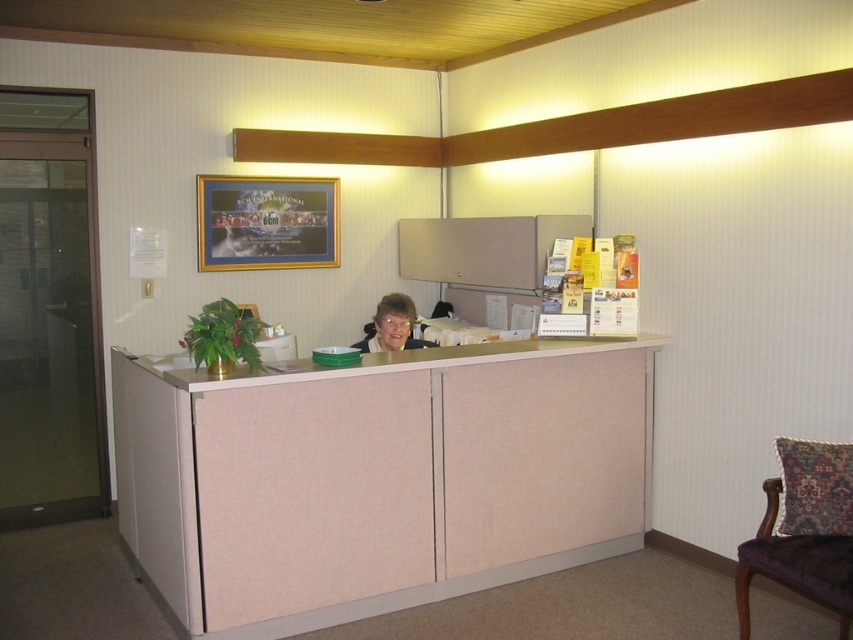
Does velvet purple chair at lower right appear over matte black hair at center?

Actually, velvet purple chair at lower right is below matte black hair at center.

Is velvet purple chair at lower right taller than matte black hair at center?

Indeed, velvet purple chair at lower right has a greater height compared to matte black hair at center.

What do you see at coordinates (804, 529) in the screenshot? I see `velvet purple chair at lower right` at bounding box center [804, 529].

Where is `velvet purple chair at lower right`? Image resolution: width=853 pixels, height=640 pixels. velvet purple chair at lower right is located at coordinates click(x=804, y=529).

Which is in front, point (479, 483) or point (780, 483)?

Point (780, 483) is more forward.

Is beige fabric desk at center positioned before velvet purple chair at lower right?

No, beige fabric desk at center is further to the viewer.

You are a GUI agent. You are given a task and a screenshot of the screen. Output one action in this format:
    pyautogui.click(x=<x>, y=<y>)
    Task: Click on the beige fabric desk at center
    
    Given the screenshot: What is the action you would take?
    coord(378,477)

Which is in front, point (387, 496) or point (422, 346)?

Point (387, 496) is more forward.

Is beige fabric desk at center behind matte black hair at center?

No, it is not.

Who is more forward, [553,403] or [410,330]?

Positioned in front is point [553,403].

Find the location of a particular element. The height and width of the screenshot is (640, 853). beige fabric desk at center is located at coordinates (378, 477).